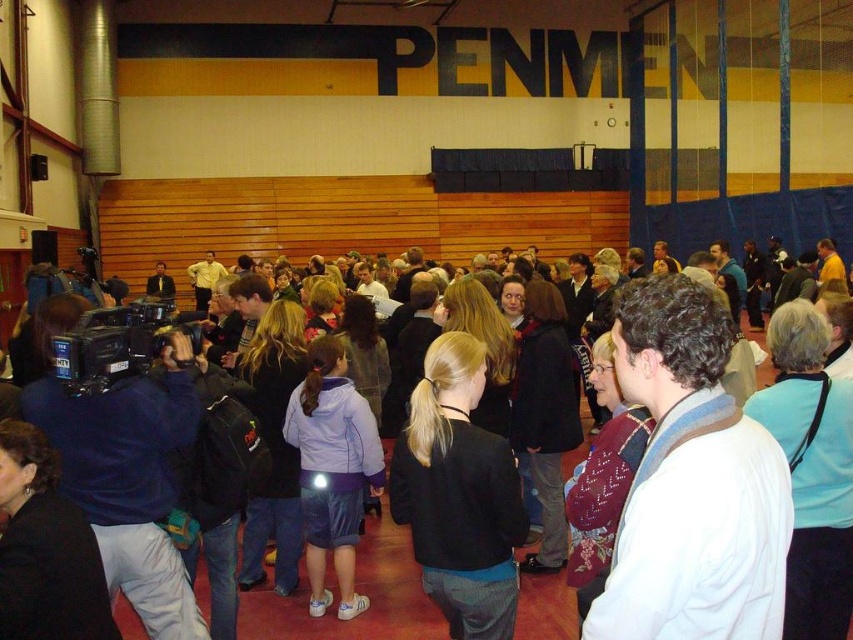
You are standing in the gymnasium and notice two people wearing a white wool sweater at center and a black matte jacket at center. Which person is closer to you?

The white wool sweater at center is closer to you because it is in front of the black matte jacket at center.

You are organizing a photo shoot and need to arrange the white wool sweater at center and the black matte jacket at center in a way that they are both visible in the frame. Given their sizes, which item should you place closer to the camera to ensure both are fully visible?

The white wool sweater at center occupies less space than the black matte jacket at center, so you should place the black matte jacket at center closer to the camera to ensure both items are fully visible in the frame.